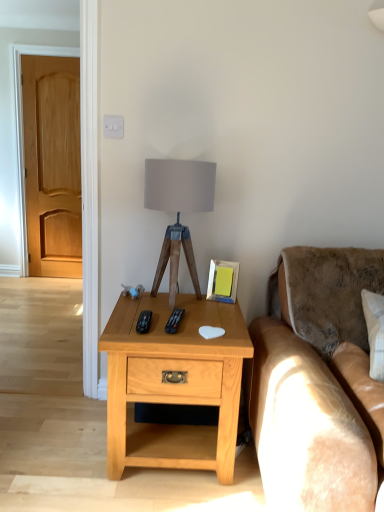
Where is `free point above light wood/texturedesk at center (from a real-world perspective)`? The image size is (384, 512). free point above light wood/texturedesk at center (from a real-world perspective) is located at coordinates (177, 306).